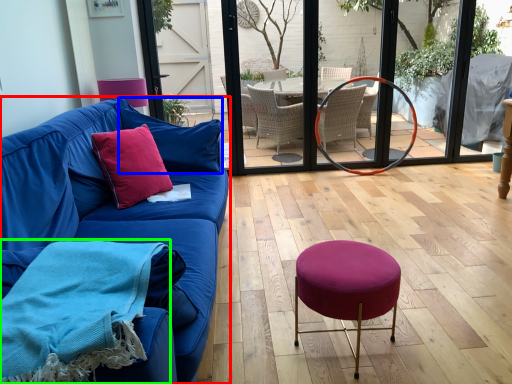
Question: Based on their relative distances, which object is farther from studio couch (highlighted by a red box)? Choose from pillow (highlighted by a blue box) and blanket (highlighted by a green box).

Choices:
 (A) pillow
 (B) blanket

Answer: (B)